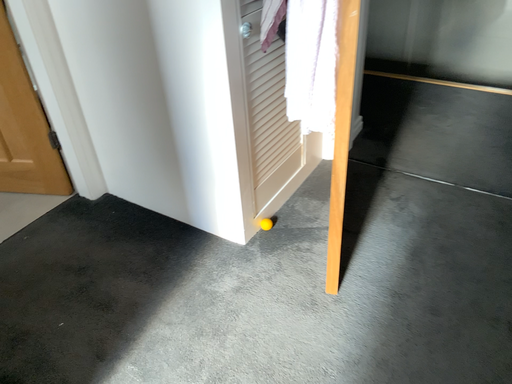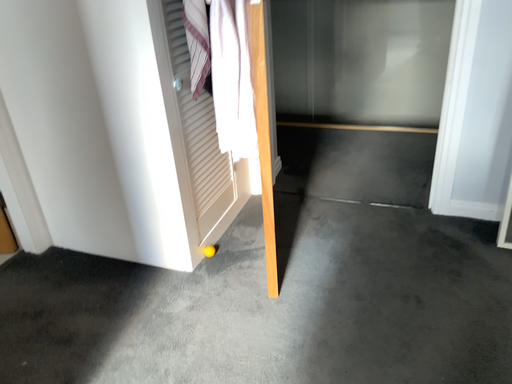
Question: How did the camera likely rotate when shooting the video?

Choices:
 (A) rotated upward
 (B) rotated downward

Answer: (A)